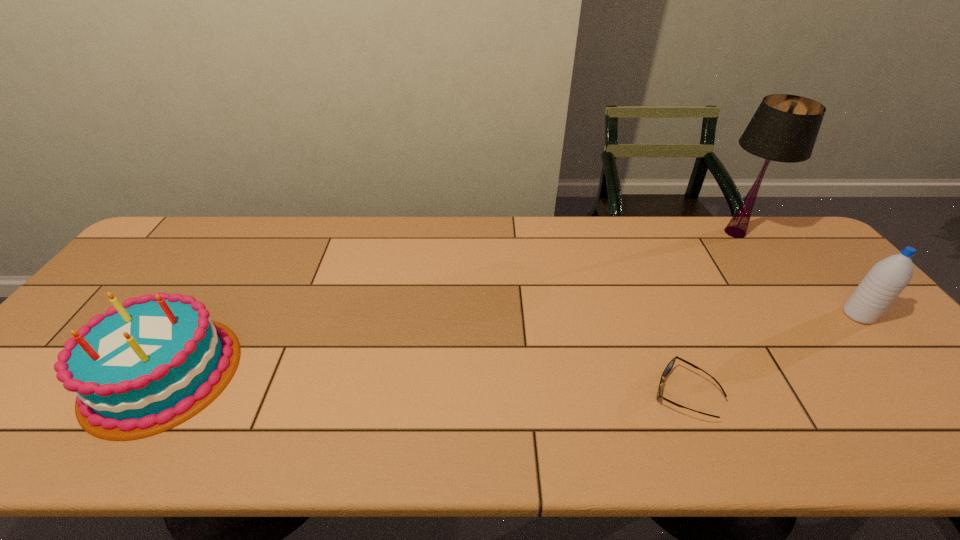
Locate an element on the screen. The width and height of the screenshot is (960, 540). free space located 0.200m at the front of the sunglasses showing the lenses is located at coordinates (562, 393).

Where is `vacant space located at the front of the sunglasses showing the lenses`? Image resolution: width=960 pixels, height=540 pixels. vacant space located at the front of the sunglasses showing the lenses is located at coordinates (522, 393).

Locate an element on the screen. object at the far edge is located at coordinates (784, 128).

At what (x,y) coordinates should I click in order to perform the action: click on birthday cake situated at the near edge. Please return your answer as a coordinate pair (x, y). The width and height of the screenshot is (960, 540). Looking at the image, I should click on (147, 365).

Where is `sunglasses that is positioned at the near edge`? The image size is (960, 540). sunglasses that is positioned at the near edge is located at coordinates [668, 368].

This screenshot has height=540, width=960. Find the location of `object present at the left edge`. object present at the left edge is located at coordinates (147, 365).

Locate an element on the screen. The width and height of the screenshot is (960, 540). lampshade at the right edge is located at coordinates (784, 128).

Where is `water bottle present at the right edge`? The width and height of the screenshot is (960, 540). water bottle present at the right edge is located at coordinates (887, 278).

Find the location of a particular element. object that is at the near left corner is located at coordinates (147, 365).

This screenshot has height=540, width=960. Find the location of `object situated at the far right corner`. object situated at the far right corner is located at coordinates (784, 128).